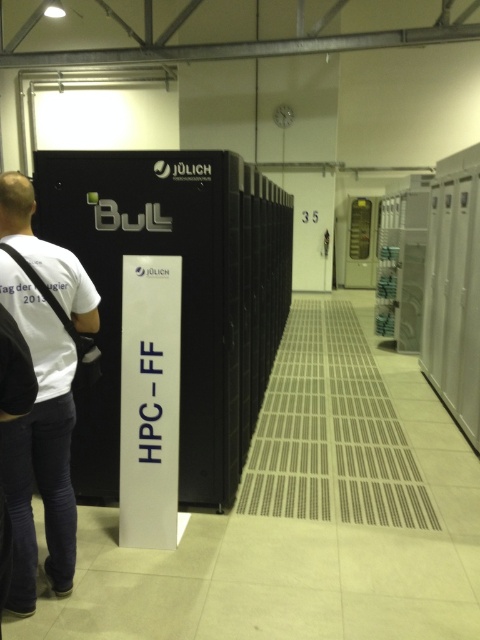
Is the position of black metal server at center less distant than that of white t-shirt at left?

No.

Between point (101, 364) and point (69, 317), which one is positioned in front?

Point (69, 317)

What do you see at coordinates (181, 296) in the screenshot? I see `black metal server at center` at bounding box center [181, 296].

Identify the location of black metal server at center. Image resolution: width=480 pixels, height=640 pixels. point(181,296).